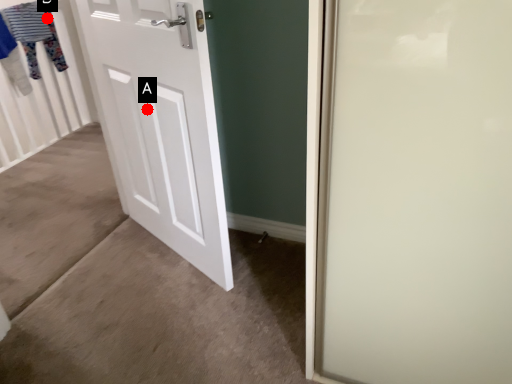
Question: Two points are circled on the image, labeled by A and B beside each circle. Which of the following is the closest to the observer?

Choices:
 (A) A is closer
 (B) B is closer

Answer: (A)